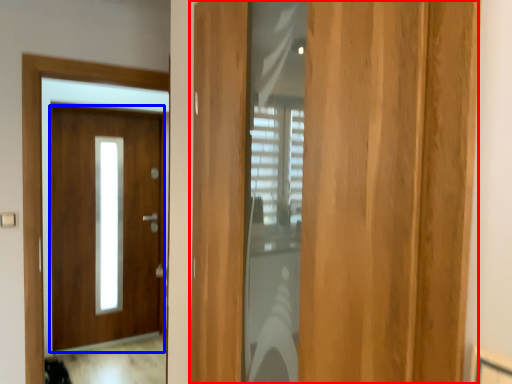
Question: Which of the following is the farthest to the observer, door (highlighted by a red box) or door (highlighted by a blue box)?

Choices:
 (A) door
 (B) door

Answer: (B)